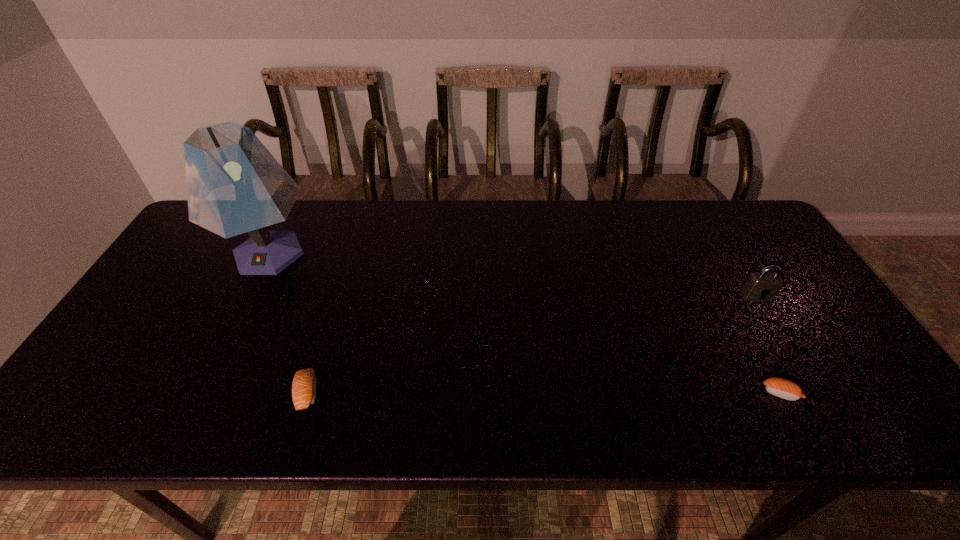
At what (x,y) coordinates should I click in order to perform the action: click on empty space that is in between the third object from right to left and the right sushi. Please return your answer as a coordinate pair (x, y). The width and height of the screenshot is (960, 540). Looking at the image, I should click on (544, 393).

At what (x,y) coordinates should I click in order to perform the action: click on vacant space that's between the right sushi and the third object from right to left. Please return your answer as a coordinate pair (x, y). The height and width of the screenshot is (540, 960). Looking at the image, I should click on coord(544,393).

Locate an element on the screen. free space between the second farthest object and the lampshade is located at coordinates (513, 275).

Where is `free area in between the right sushi and the second tallest object`? The image size is (960, 540). free area in between the right sushi and the second tallest object is located at coordinates (769, 345).

You are a GUI agent. You are given a task and a screenshot of the screen. Output one action in this format:
    pyautogui.click(x=<x>, y=<y>)
    Task: Click on the free space between the third shortest object and the lampshade
    The width and height of the screenshot is (960, 540).
    Given the screenshot: What is the action you would take?
    pyautogui.click(x=513, y=275)

You are a GUI agent. You are given a task and a screenshot of the screen. Output one action in this format:
    pyautogui.click(x=<x>, y=<y>)
    Task: Click on the blank region between the right sushi and the third shortest object
    
    Given the screenshot: What is the action you would take?
    pyautogui.click(x=769, y=345)

The height and width of the screenshot is (540, 960). Identify the location of free area in between the tallest object and the right sushi. (525, 323).

Identify the location of empty space that is in between the right sushi and the tallest object. (525, 323).

Where is `the third closest object relative to the tallest object`? The image size is (960, 540). the third closest object relative to the tallest object is located at coordinates pos(762,286).

Locate which object is the closest to the leftmost object. Please provide its 2D coordinates. Your answer should be formatted as a tuple, i.e. [(x, y)], where the tuple contains the x and y coordinates of a point satisfying the conditions above.

[(304, 386)]